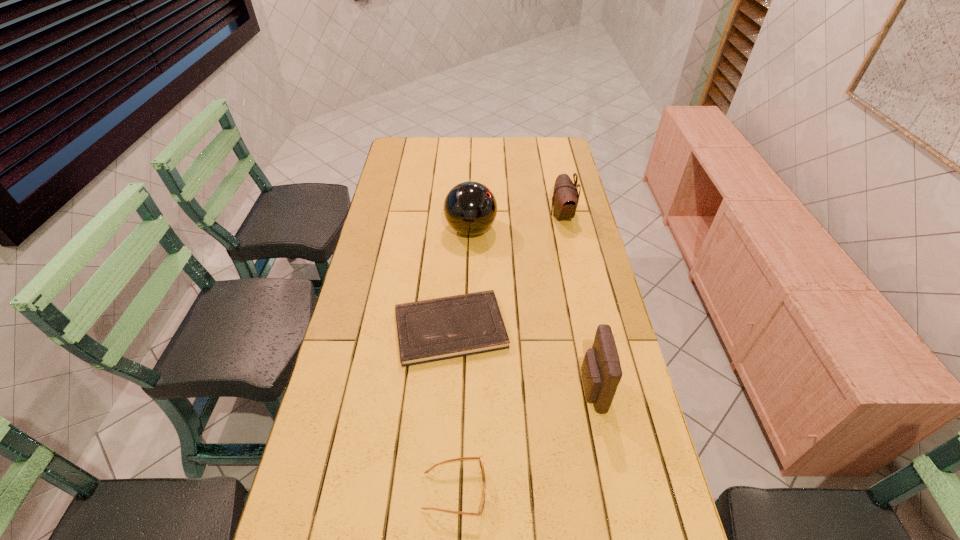
This screenshot has height=540, width=960. I want to click on bowling ball, so click(470, 208).

Identify the location of the nearer pouch. (601, 371).

Identify the location of the farther pouch. This screenshot has height=540, width=960. (565, 198).

You are a GUI agent. You are given a task and a screenshot of the screen. Output one action in this format:
    pyautogui.click(x=<x>, y=<y>)
    Task: Click on the fourth tallest object
    This screenshot has width=960, height=540.
    Given the screenshot: What is the action you would take?
    pyautogui.click(x=464, y=458)

I want to click on the nearest object, so click(x=464, y=458).

Image resolution: width=960 pixels, height=540 pixels. Identify the location of paperback book. (437, 329).

Identify the location of free space located 0.200m on the surface of the bowling ball near the finger holes. Image resolution: width=960 pixels, height=540 pixels. (551, 230).

Identify the location of vacant region located with an open flap on the nearer pouch. (466, 389).

Identify the location of vacant space situated 0.320m with an open flap on the nearer pouch. (458, 389).

Locate an element on the screen. The width and height of the screenshot is (960, 540). vacant space located 0.330m with an open flap on the nearer pouch is located at coordinates (454, 389).